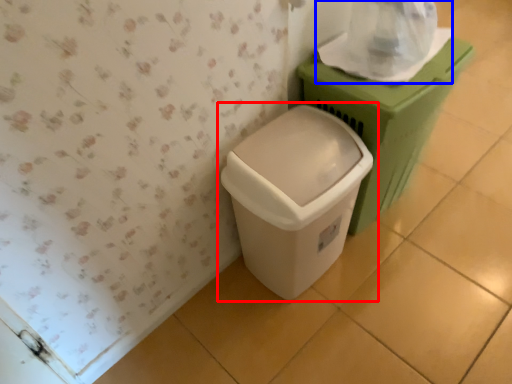
Question: Which object appears farthest to the camera in this image, waste container (highlighted by a red box) or toilet paper (highlighted by a blue box)?

Choices:
 (A) waste container
 (B) toilet paper

Answer: (B)